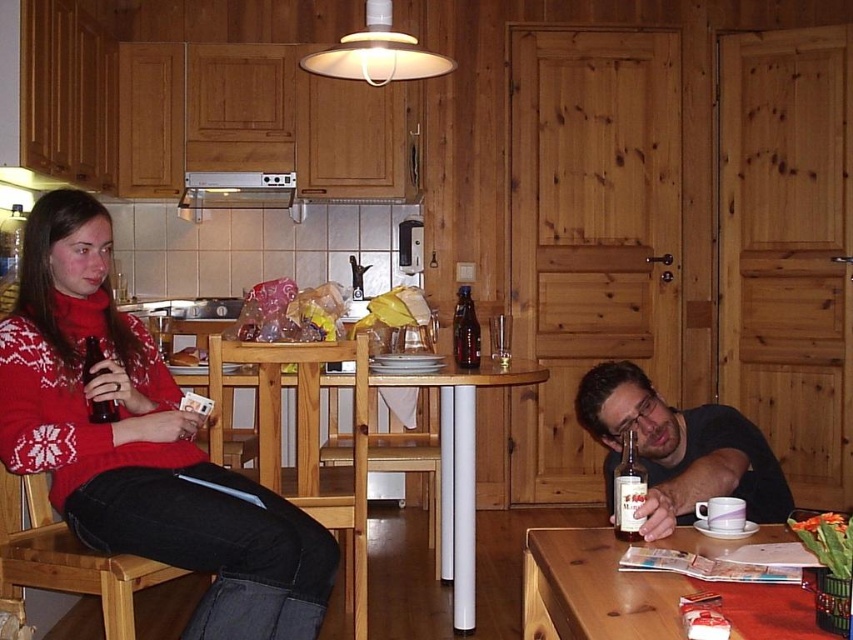
You are a waiter in a restaurant and need to deliver a drink to the customer. The customer is sitting at the table with the matte black shirt at lower right and the translucent glass bottle at table center. Which object should you avoid placing the drink near to prevent it from being too close to the customer?

You should avoid placing the drink near the translucent glass bottle at table center because the matte black shirt at lower right is located below it, meaning the shirt is closer to the table edge where the customer is sitting. Placing the drink near the bottle might be too close to the customer.

You are a bartender preparing drinks for a customer. You see the matte black shirt at lower right and the translucent glass bottle at table center. Which object is bigger?

The matte black shirt at lower right is larger in size than the translucent glass bottle at table center.